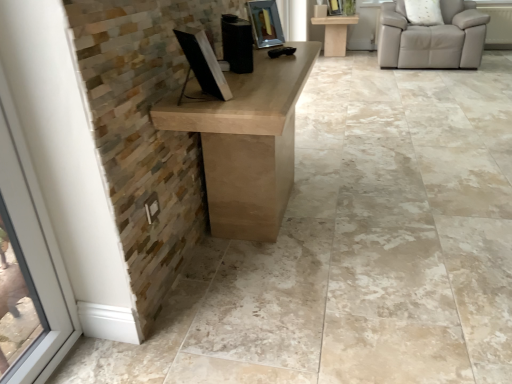
Image resolution: width=512 pixels, height=384 pixels. I want to click on white fabric pillow at upper right, so click(423, 12).

What is the approximate height of beige leather chair at upper right?

beige leather chair at upper right is 19.63 inches in height.

Locate an element on the screen. Image resolution: width=512 pixels, height=384 pixels. matte silver picture frame at upper center, which ranks as the 2th picture frame in bottom-to-top order is located at coordinates (334, 7).

Consider the image. Measure the distance from matte silver picture frame at upper center, the first picture frame when ordered from back to front, to matte beige table at upper center.

They are 9.48 inches apart.

Looking at their sizes, would you say matte silver picture frame at upper center, the first picture frame when ordered from back to front, is wider or thinner than matte beige table at upper center?

Clearly, matte silver picture frame at upper center, the first picture frame when ordered from back to front, has less width compared to matte beige table at upper center.

Is matte silver picture frame at upper center, the 2th picture frame viewed from the left, oriented away from matte beige table at upper center?

No, matte silver picture frame at upper center, the 2th picture frame viewed from the left, is not facing away from matte beige table at upper center.

Between matte silver picture frame at upper center, marked as the first picture frame in a top-to-bottom arrangement, and matte beige table at upper center, which one appears on the right side from the viewer's perspective?

Positioned to the right is matte beige table at upper center.

From the image's perspective, between beige leather chair at upper right and metallic reflective picture frame at upper center, positioned as the 1th picture frame in left-to-right order, who is located below?

metallic reflective picture frame at upper center, positioned as the 1th picture frame in left-to-right order, from the image's perspective.

From a real-world perspective, who is located higher, beige leather chair at upper right or metallic reflective picture frame at upper center, positioned as the second picture frame in top-to-bottom order?

metallic reflective picture frame at upper center, positioned as the second picture frame in top-to-bottom order, from a real-world perspective.

Is beige leather chair at upper right positioned far away from metallic reflective picture frame at upper center, positioned as the 1th picture frame in left-to-right order?

Indeed, beige leather chair at upper right is not near metallic reflective picture frame at upper center, positioned as the 1th picture frame in left-to-right order.

In the scene shown: Would you say beige leather chair at upper right contains metallic reflective picture frame at upper center, which is counted as the 1th picture frame, starting from the front?

No, metallic reflective picture frame at upper center, which is counted as the 1th picture frame, starting from the front, is located outside of beige leather chair at upper right.

From a real-world perspective, relative to matte silver picture frame at upper center, the 2th picture frame viewed from the left, is metallic reflective picture frame at upper center, which is the second picture frame from back to front, vertically above or below?

In terms of real-world spatial position, metallic reflective picture frame at upper center, which is the second picture frame from back to front, is above matte silver picture frame at upper center, the 2th picture frame viewed from the left.

From the image's perspective, does metallic reflective picture frame at upper center, positioned as the 1th picture frame in left-to-right order, appear lower than matte silver picture frame at upper center, marked as the second picture frame in a front-to-back arrangement?

Yes, from the image's perspective, metallic reflective picture frame at upper center, positioned as the 1th picture frame in left-to-right order, is beneath matte silver picture frame at upper center, marked as the second picture frame in a front-to-back arrangement.

Which is behind, point (260, 46) or point (329, 13)?

The point (329, 13) is farther.

This screenshot has height=384, width=512. I want to click on picture frame that appears above the metallic reflective picture frame at upper center, positioned as the second picture frame in top-to-bottom order (from the image's perspective), so click(334, 7).

From a real-world perspective, does white fabric pillow at upper right sit lower than beige leather chair at upper right?

No, from a real-world perspective, white fabric pillow at upper right is not beneath beige leather chair at upper right.

Is white fabric pillow at upper right oriented away from beige leather chair at upper right?

Yes, beige leather chair at upper right is at the back of white fabric pillow at upper right.

Which is more to the right, white fabric pillow at upper right or beige leather chair at upper right?

beige leather chair at upper right is more to the right.

Is black matte speaker at center positioned in front of beige leather chair at upper right?

Yes, the depth of black matte speaker at center is less than that of beige leather chair at upper right.

Between black matte speaker at center and beige leather chair at upper right, which one appears on the right side from the viewer's perspective?

beige leather chair at upper right is more to the right.

Is beige leather chair at upper right surrounded by black matte speaker at center?

No, beige leather chair at upper right is not a part of black matte speaker at center.

Can you tell me how much black matte speaker at center and beige leather chair at upper right differ in facing direction?

The angle between the facing direction of black matte speaker at center and the facing direction of beige leather chair at upper right is 125 degrees.

Considering the sizes of objects black matte speaker at center and metallic reflective picture frame at upper center, marked as the 1th picture frame in a bottom-to-top arrangement, in the image provided, who is wider, black matte speaker at center or metallic reflective picture frame at upper center, marked as the 1th picture frame in a bottom-to-top arrangement,?

metallic reflective picture frame at upper center, marked as the 1th picture frame in a bottom-to-top arrangement.

The image size is (512, 384). Identify the location of the 1st picture frame behind the black matte speaker at center. (265, 23).

Considering the positions of objects black matte speaker at center and metallic reflective picture frame at upper center, which is counted as the 1th picture frame, starting from the front, in the image provided, who is in front, black matte speaker at center or metallic reflective picture frame at upper center, which is counted as the 1th picture frame, starting from the front,?

black matte speaker at center.

Considering the sizes of objects black matte speaker at center and metallic reflective picture frame at upper center, positioned as the second picture frame in top-to-bottom order, in the image provided, who is shorter, black matte speaker at center or metallic reflective picture frame at upper center, positioned as the second picture frame in top-to-bottom order,?

black matte speaker at center.

From a real-world perspective, who is located higher, matte beige table at upper center or black matte speaker at center?

black matte speaker at center is physically above.

Considering the positions of objects matte beige table at upper center and black matte speaker at center in the image provided, who is behind, matte beige table at upper center or black matte speaker at center?

Positioned behind is matte beige table at upper center.

Locate an element on the screen. This screenshot has height=384, width=512. speaker in front of the matte beige table at upper center is located at coordinates (237, 43).

Is black matte speaker at center at the back of matte beige table at upper center?

No, matte beige table at upper center is not facing away from black matte speaker at center.

At what (x,y) coordinates should I click in order to perform the action: click on the 1st picture frame counting from the left of the matte beige table at upper center. Please return your answer as a coordinate pair (x, y). Image resolution: width=512 pixels, height=384 pixels. Looking at the image, I should click on (334, 7).

Where is `picture frame located below the beige leather chair at upper right (from the image's perspective)`? Image resolution: width=512 pixels, height=384 pixels. picture frame located below the beige leather chair at upper right (from the image's perspective) is located at coordinates (265, 23).

Which object lies further to the anchor point beige leather chair at upper right, matte beige table at upper center or white fabric pillow at upper right?

Among the two, matte beige table at upper center is located further to beige leather chair at upper right.

Based on their spatial positions, is matte silver picture frame at upper center, positioned as the 1th picture frame in right-to-left order, or black matte speaker at center closer to matte beige table at upper center?

Among the two, matte silver picture frame at upper center, positioned as the 1th picture frame in right-to-left order, is located nearer to matte beige table at upper center.

Looking at the image, which one is located further to metallic reflective picture frame at upper center, positioned as the 1th picture frame in left-to-right order, matte beige table at upper center or black matte speaker at center?

The object further to metallic reflective picture frame at upper center, positioned as the 1th picture frame in left-to-right order, is matte beige table at upper center.

Considering their positions, is beige leather chair at upper right positioned further to metallic reflective picture frame at upper center, marked as the second picture frame in a right-to-left arrangement, than black matte speaker at center?

Among the two, beige leather chair at upper right is located further to metallic reflective picture frame at upper center, marked as the second picture frame in a right-to-left arrangement.

Estimate the real-world distances between objects in this image. Which object is closer to matte silver picture frame at upper center, marked as the first picture frame in a top-to-bottom arrangement, black matte speaker at center or matte beige table at upper center?

Among the two, matte beige table at upper center is located nearer to matte silver picture frame at upper center, marked as the first picture frame in a top-to-bottom arrangement.

Which object lies nearer to the anchor point white fabric pillow at upper right, matte beige table at upper center or black matte speaker at center?

The object closer to white fabric pillow at upper right is matte beige table at upper center.

From the picture: Estimate the real-world distances between objects in this image. Which object is further from white fabric pillow at upper right, metallic reflective picture frame at upper center, which is the second picture frame from back to front, or beige leather chair at upper right?

Based on the image, metallic reflective picture frame at upper center, which is the second picture frame from back to front, appears to be further to white fabric pillow at upper right.

Which object lies nearer to the anchor point beige leather chair at upper right, white fabric pillow at upper right or metallic reflective picture frame at upper center, marked as the second picture frame in a right-to-left arrangement?

white fabric pillow at upper right.

Image resolution: width=512 pixels, height=384 pixels. Identify the location of table positioned between metallic reflective picture frame at upper center, positioned as the second picture frame in top-to-bottom order, and matte silver picture frame at upper center, which ranks as the 2th picture frame in bottom-to-top order, from near to far. (335, 33).

Image resolution: width=512 pixels, height=384 pixels. Find the location of `pillow located between black matte speaker at center and beige leather chair at upper right in the depth direction`. pillow located between black matte speaker at center and beige leather chair at upper right in the depth direction is located at coordinates (423, 12).

Find the location of a particular element. This screenshot has height=384, width=512. pillow between metallic reflective picture frame at upper center, which is counted as the 1th picture frame, starting from the front, and beige leather chair at upper right in the front-back direction is located at coordinates (423, 12).

Find the location of `pillow between metallic reflective picture frame at upper center, positioned as the second picture frame in top-to-bottom order, and matte silver picture frame at upper center, marked as the first picture frame in a top-to-bottom arrangement, in the front-back direction`. pillow between metallic reflective picture frame at upper center, positioned as the second picture frame in top-to-bottom order, and matte silver picture frame at upper center, marked as the first picture frame in a top-to-bottom arrangement, in the front-back direction is located at coordinates (423, 12).